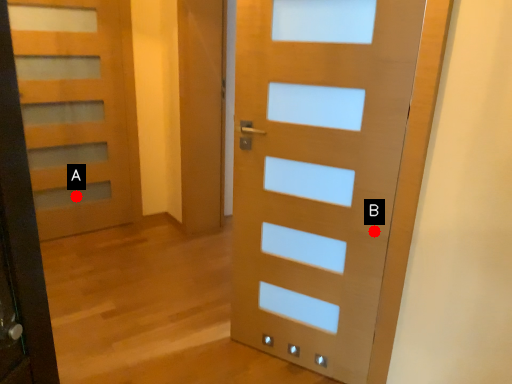
Question: Two points are circled on the image, labeled by A and B beside each circle. Which of the following is the closest to the observer?

Choices:
 (A) A is closer
 (B) B is closer

Answer: (B)